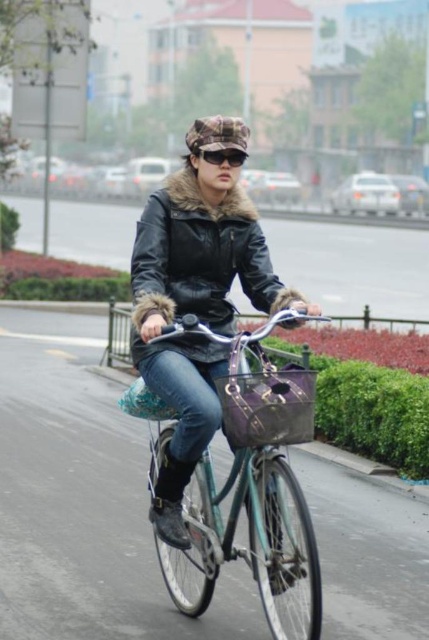
Is point (238, 380) positioned before point (218, 161)?

Yes, point (238, 380) is closer to viewer.

Does teal metallic bicycle at center appear under black matte sunglasses at center?

Correct, teal metallic bicycle at center is located below black matte sunglasses at center.

Identify the location of teal metallic bicycle at center. (251, 477).

I want to click on teal metallic bicycle at center, so click(251, 477).